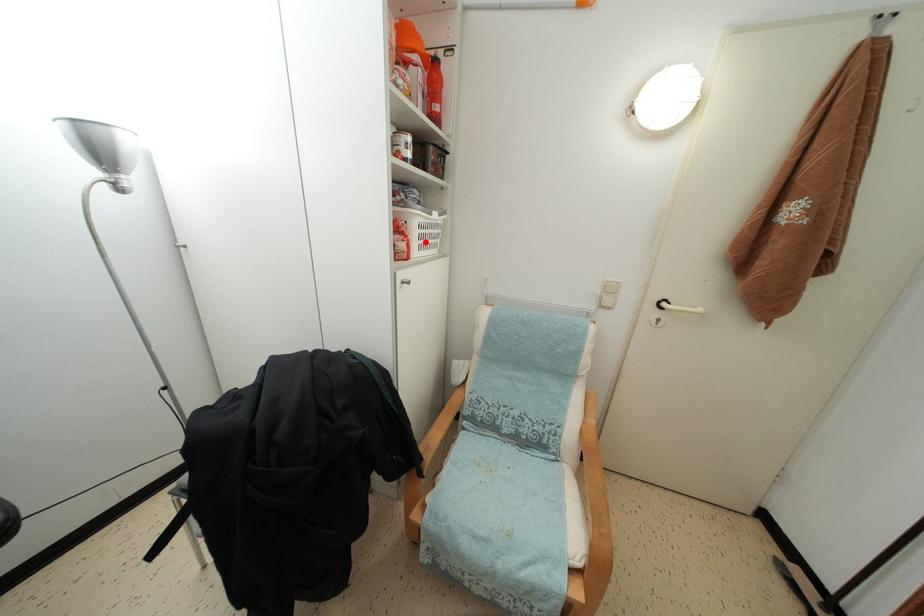
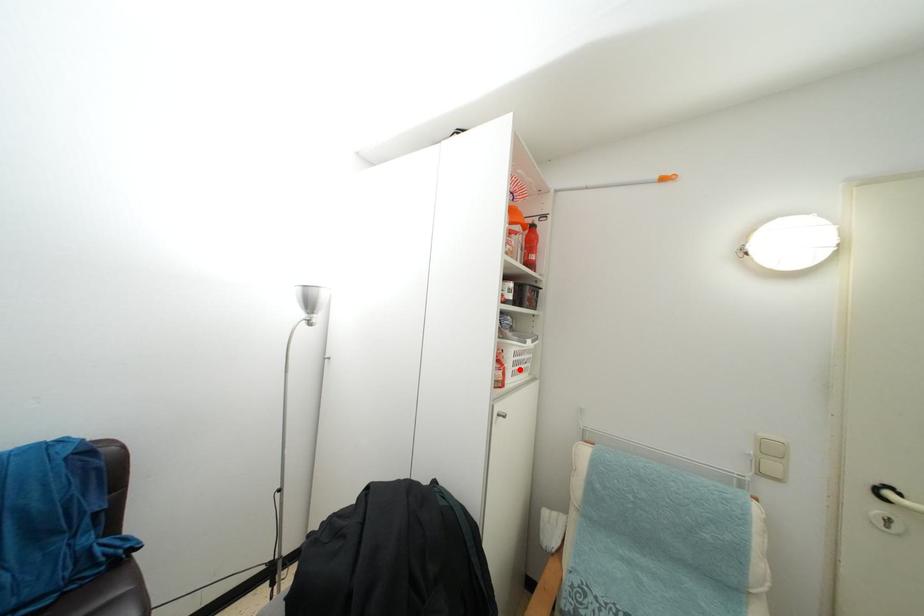
I am providing you with two images of the same scene from different viewpoints. A red point is marked on the first image and another point is marked on the second image. Is the marked point in image1 the same physical position as the marked point in image2?

Yes